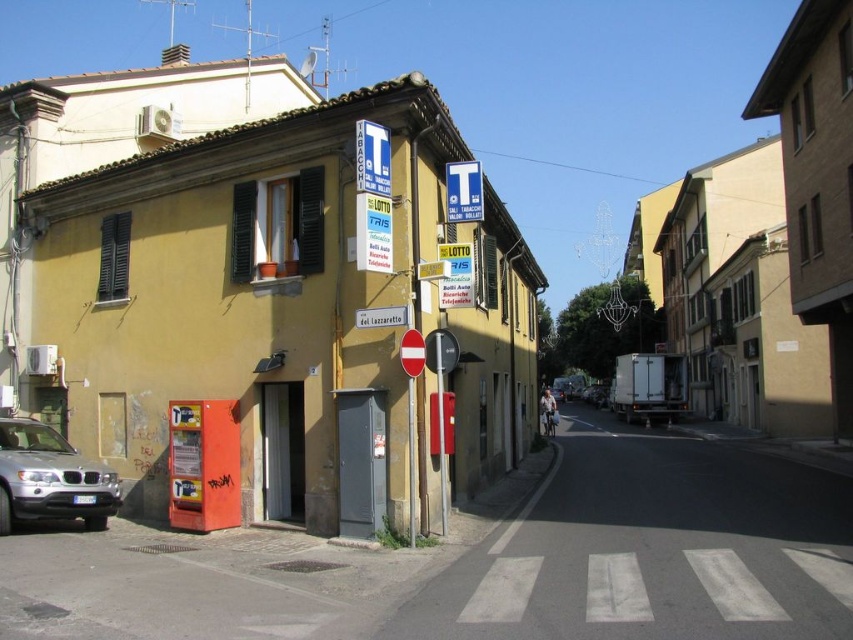
Is concrete sidewalk at lower center behind silver metallic suv at lower left?

No, it is in front of silver metallic suv at lower left.

Is concrete sidewalk at lower center below silver metallic suv at lower left?

Correct, concrete sidewalk at lower center is located below silver metallic suv at lower left.

The image size is (853, 640). What do you see at coordinates (653, 548) in the screenshot?
I see `concrete sidewalk at lower center` at bounding box center [653, 548].

Identify the location of concrete sidewalk at lower center. This screenshot has height=640, width=853. (653, 548).